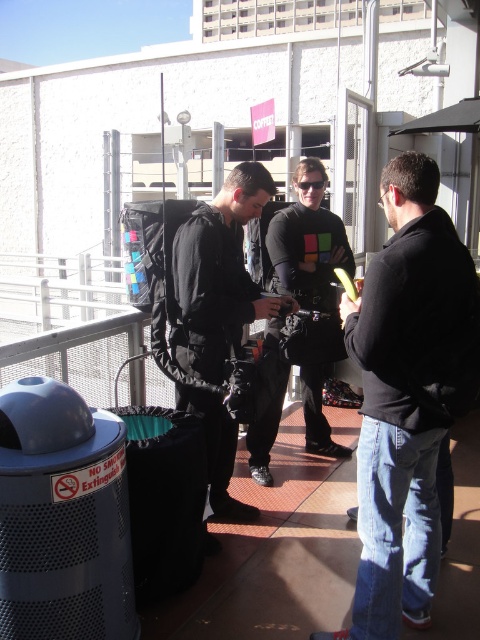
Consider the image. Is black matte jacket at center to the right of black matte shirt at center from the viewer's perspective?

No, black matte jacket at center is not to the right of black matte shirt at center.

Does point (248, 189) come behind point (280, 289)?

No, it is not.

In order to click on black matte jacket at center in this screenshot , I will do `click(218, 276)`.

Does black matte jacket at right appear over black matte shirt at center?

Incorrect, black matte jacket at right is not positioned above black matte shirt at center.

Is point (465, 308) closer to camera compared to point (301, 396)?

Yes, it is in front of point (301, 396).

The image size is (480, 640). What are the coordinates of `black matte jacket at right` in the screenshot? It's located at (404, 396).

Does black matte jacket at right appear on the right side of black matte jacket at center?

Indeed, black matte jacket at right is positioned on the right side of black matte jacket at center.

Does black matte jacket at right have a lesser width compared to black matte jacket at center?

Yes, black matte jacket at right is thinner than black matte jacket at center.

Is point (416, 556) less distant than point (239, 186)?

Yes, point (416, 556) is in front of point (239, 186).

The width and height of the screenshot is (480, 640). Identify the location of black matte jacket at right. (404, 396).